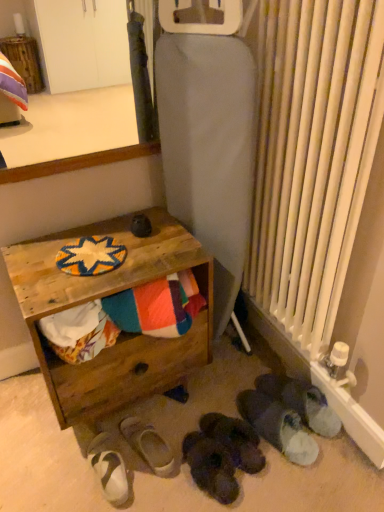
The height and width of the screenshot is (512, 384). I want to click on free space to the back side of white fabric slipper at lower center, which appears as the fifth footwear when viewed from the right, so click(x=173, y=403).